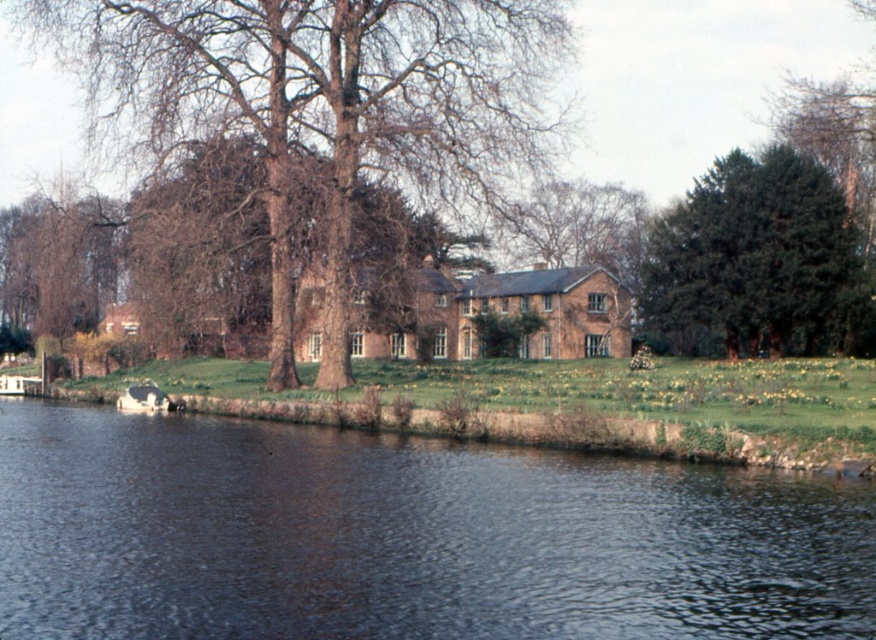
Is point (460, 131) positioned before point (73, 248)?

Yes, point (460, 131) is in front of point (73, 248).

Between point (369, 44) and point (25, 292), which one is positioned behind?

Point (25, 292)

Describe the element at coordinates (323, 100) in the screenshot. The height and width of the screenshot is (640, 876). I see `brown textured tree at center` at that location.

The image size is (876, 640). Identify the location of brown textured tree at center. (323, 100).

This screenshot has width=876, height=640. I want to click on bare wood tree at left, so click(55, 266).

Can you confirm if bare wood tree at left is positioned above bare branches at center?

No.

Who is more forward, (x=99, y=243) or (x=583, y=204)?

Positioned in front is point (x=99, y=243).

This screenshot has height=640, width=876. I want to click on bare wood tree at left, so click(x=55, y=266).

Can you confirm if dark blue water at lower left is taller than brown textured tree at center?

No.

Between dark blue water at lower left and brown textured tree at center, which one appears on the right side from the viewer's perspective?

dark blue water at lower left is more to the right.

Locate an element on the screen. Image resolution: width=876 pixels, height=640 pixels. dark blue water at lower left is located at coordinates (404, 538).

Image resolution: width=876 pixels, height=640 pixels. Identify the location of dark blue water at lower left. (404, 538).